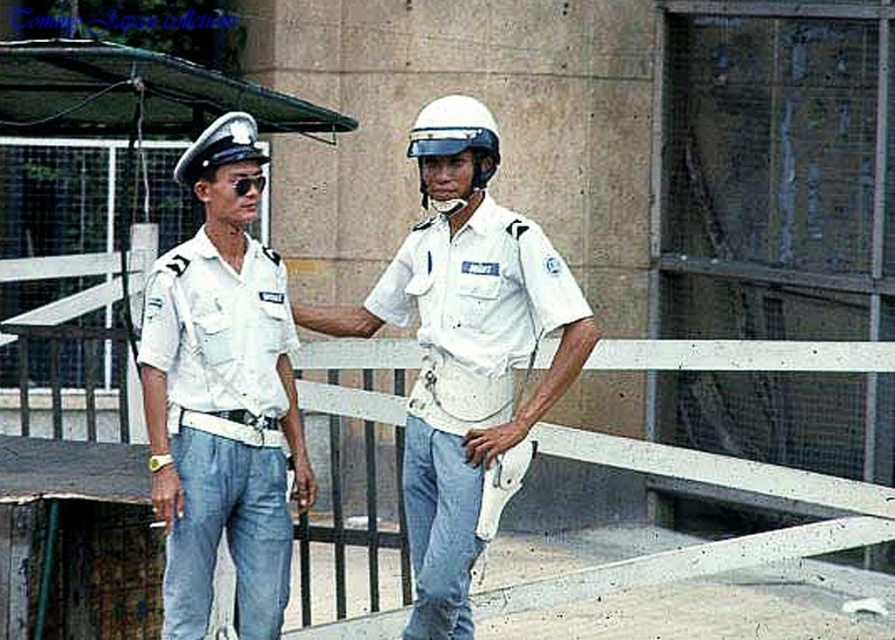
Consider the image. You are a photographer trying to capture both the white cotton shirt at left and the white matte helmet at upper left in the same frame. Given their sizes, which object would you need to position closer to the camera to ensure both appear similarly sized in your photo?

Since the white cotton shirt at left is bigger than the white matte helmet at upper left, you would need to move the white cotton shirt at left farther away from the camera and bring the white matte helmet at upper left closer. This way, their sizes in the frame would balance out.

You are a photographer trying to capture a group photo of the white cotton shirt at left and the white matte helmet at center. Since you want to ensure both subjects are clearly visible, which subject should you adjust your camera focus to prioritize based on their sizes?

The white cotton shirt at left is wider than the white matte helmet at center, so you should prioritize focusing on the white cotton shirt at left to ensure its details are clear while still capturing the white matte helmet at center in the frame.